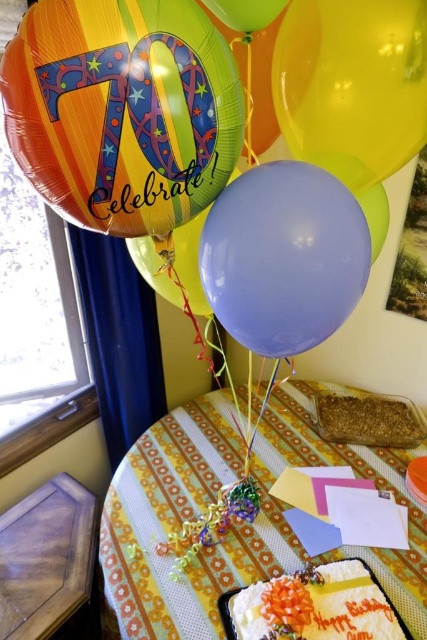
You are planning to hang the multicolored metallic balloon at upper left and the matte purple balloon at center in a narrow hallway. Considering their sizes, which balloon might be more suitable for the space?

The matte purple balloon at center is more suitable for the narrow hallway since its width is smaller than the multicolored metallic balloon at upper left, which is wider.

You are planning to hang two balloons from the ceiling. The matte purple balloon at center and the translucent yellow balloon at upper right are available. Which balloon has a greater width and would require more space horizontally?

The matte purple balloon at center has a greater width than the translucent yellow balloon at upper right, so it would require more horizontal space.